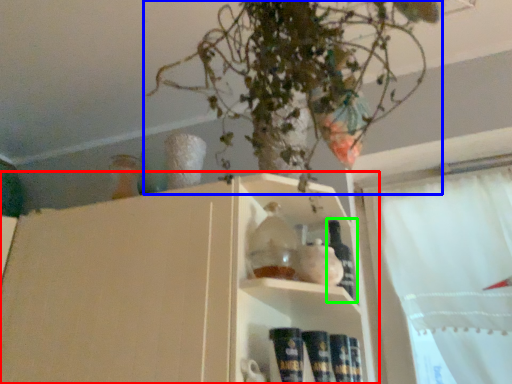
Question: Estimate the real-world distances between objects in this image. Which object is farther from shelf (highlighted by a red box), houseplant (highlighted by a blue box) or bottle (highlighted by a green box)?

Choices:
 (A) houseplant
 (B) bottle

Answer: (B)